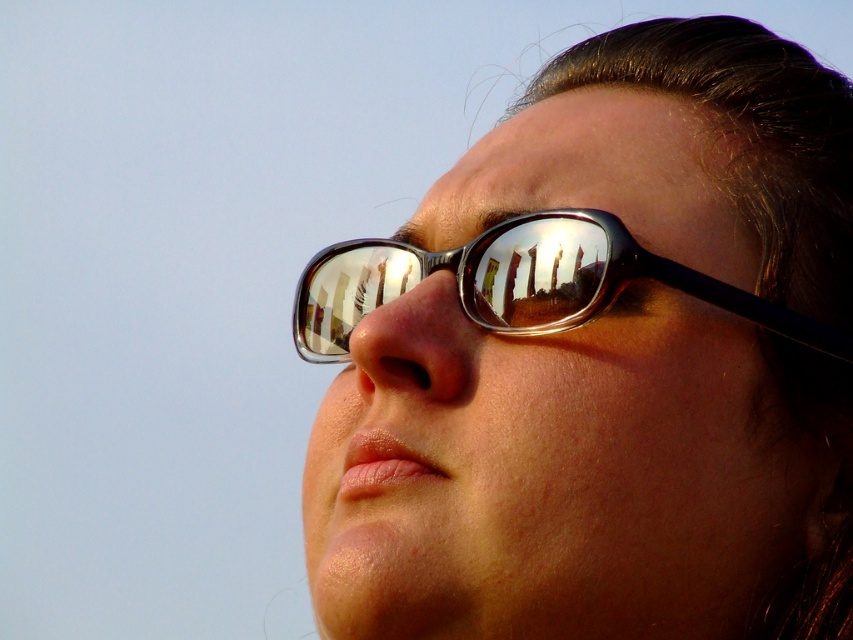
You are a photographer adjusting your camera settings to capture the reflections in the sunglasses. You notice two points of interest marked as point [334,401] and point [694,291]. Which point is closer to your camera lens?

Point [334,401] is further to the viewer than point [694,291], so the point closer to the camera lens is point [694,291].

You are a photographer adjusting your camera settings to capture the reflections in the metallic reflective glasses at upper right and metallic reflective glasses at center. Which glasses should you focus on first if you want to capture the reflection of the building with the most detail?

The metallic reflective glasses at upper right should be focused on first because they are much taller than the metallic reflective glasses at center, allowing for a clearer and more detailed reflection of the building.

You are an architect analyzing the reflection in the metallic reflective glasses at upper right. What object in the scene is reflected in the glasses?

The metallic reflective glasses at upper right reflect a building or structure with multiple windows, as seen in the reflection captured by the glasses.